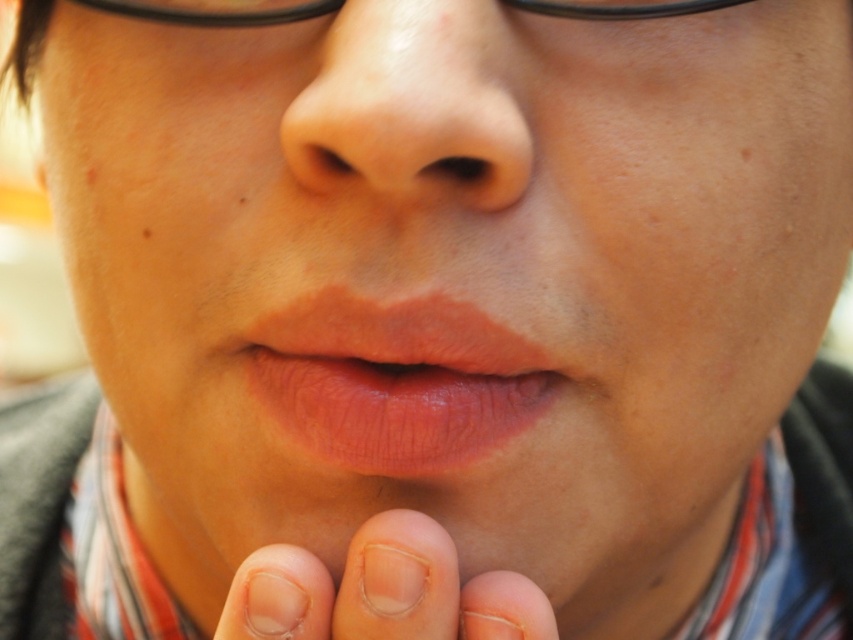
Question: Can you confirm if clear skin at lower center is bigger than black plastic glasses at upper center?

Choices:
 (A) yes
 (B) no

Answer: (B)

Question: Is smooth skin nose at center below black plastic glasses at upper center?

Choices:
 (A) no
 (B) yes

Answer: (B)

Question: Which of the following is the farthest from the observer?

Choices:
 (A) clear skin at lower center
 (B) black plastic glasses at upper center

Answer: (B)

Question: Which object is positioned closest to the black plastic glasses at upper center?

Choices:
 (A) smooth matte lips at center
 (B) smooth skin nose at center

Answer: (B)

Question: Which point is farther from the camera taking this photo?

Choices:
 (A) (286, 589)
 (B) (590, 17)
 (C) (376, 417)

Answer: (C)

Question: Does clear skin at lower center appear over black plastic glasses at upper center?

Choices:
 (A) yes
 (B) no

Answer: (B)